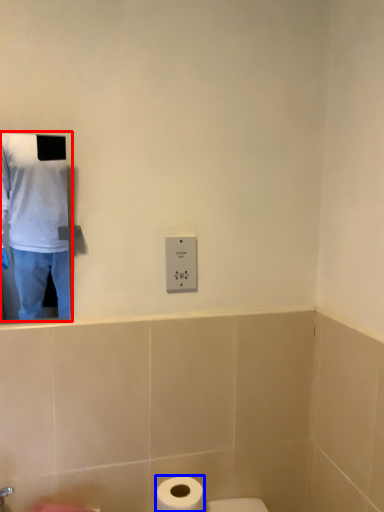
Question: Among these objects, which one is farthest to the camera, man (highlighted by a red box) or toilet paper (highlighted by a blue box)?

Choices:
 (A) man
 (B) toilet paper

Answer: (B)